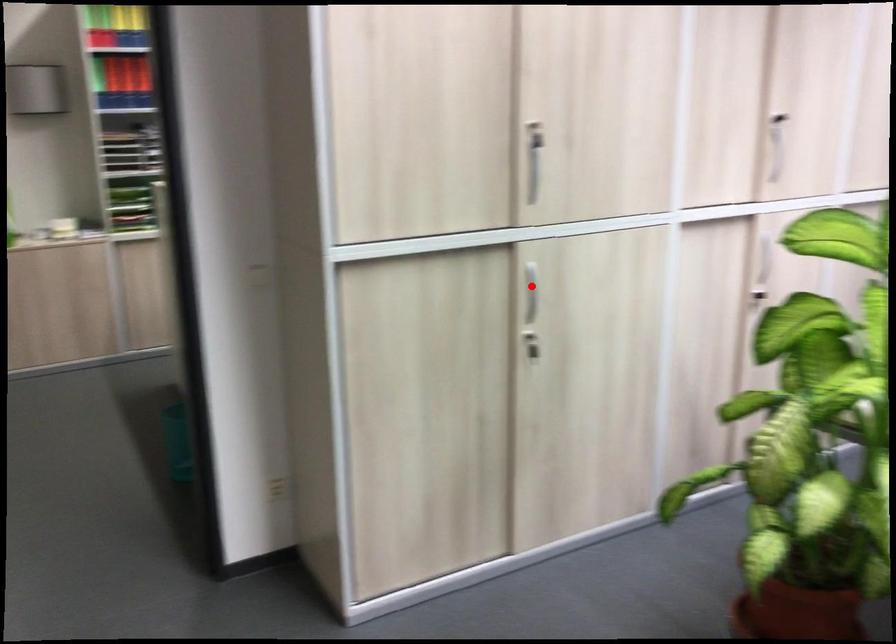
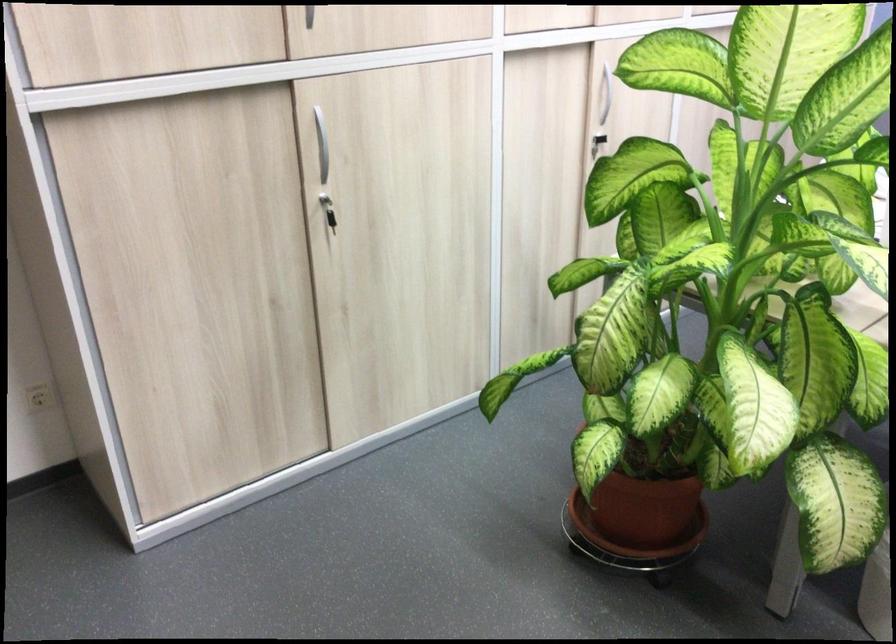
Question: A red point is marked in image1. In image2, is the corresponding 3D point closer to the camera or farther? Reply with the corresponding letter.

Choices:
 (A) The corresponding 3D point is closer.
 (B) The corresponding 3D point is farther.

Answer: (A)